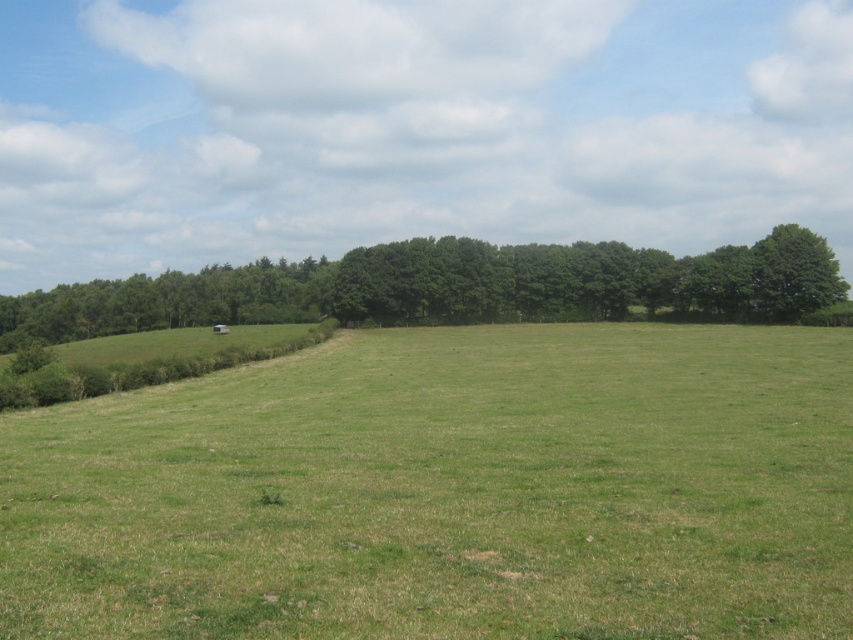
Question: Which point is farther from the camera taking this photo?

Choices:
 (A) (788, 307)
 (B) (585, 454)
 (C) (756, 316)

Answer: (C)

Question: Among these objects, which one is farthest from the camera?

Choices:
 (A) green leafy tree at right
 (B) green grass pasture at center
 (C) green leafy trees at center

Answer: (C)

Question: Is green grass pasture at center wider than green leafy tree at right?

Choices:
 (A) no
 (B) yes

Answer: (B)

Question: Is green grass pasture at center smaller than green leafy trees at center?

Choices:
 (A) yes
 (B) no

Answer: (A)

Question: Which point appears farthest from the camera in this image?

Choices:
 (A) (315, 388)
 (B) (312, 278)
 (C) (763, 262)

Answer: (B)

Question: Is green grass pasture at center above green leafy tree at right?

Choices:
 (A) no
 (B) yes

Answer: (A)